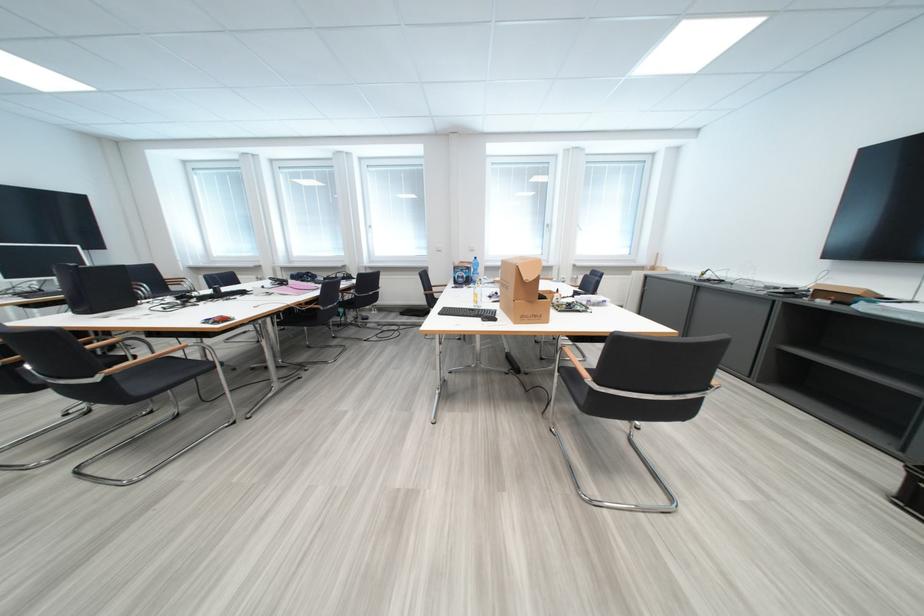
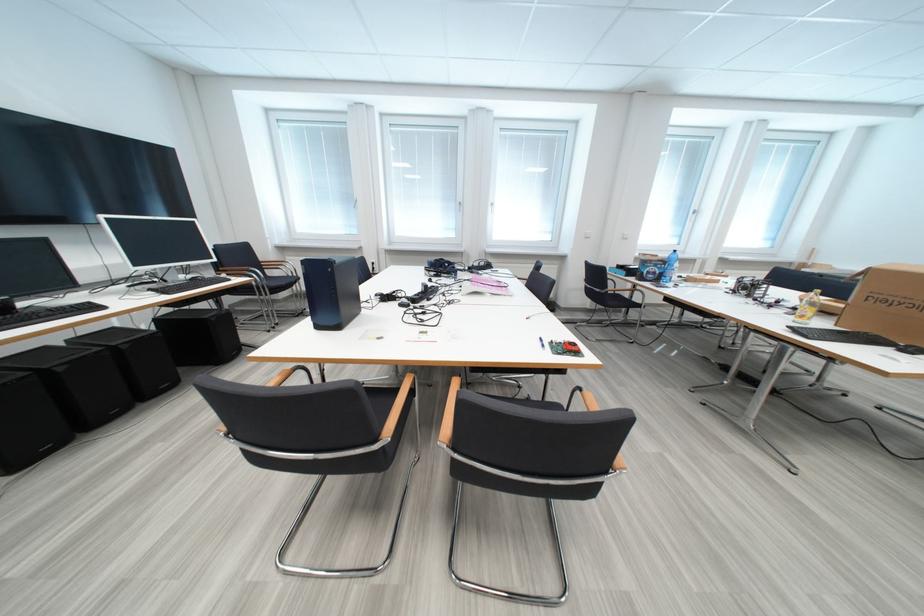
Locate, in the second image, the point that corresponds to pixel 88 315 in the first image.

(329, 330)